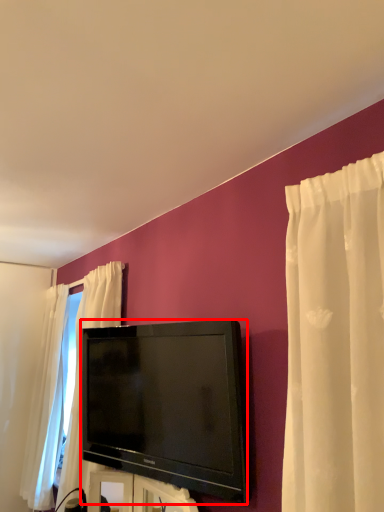
Question: Considering the relative positions of television (annotated by the red box) and furniture in the image provided, where is television (annotated by the red box) located with respect to the staircase?

Choices:
 (A) left
 (B) right

Answer: (A)